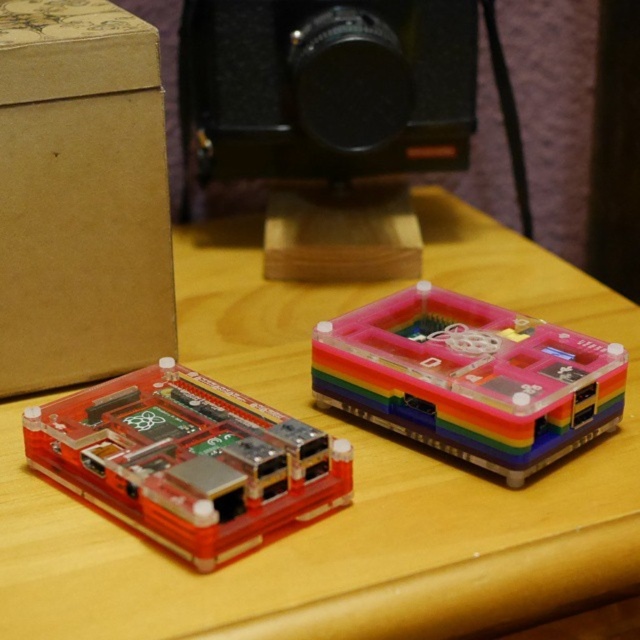
Identify the location of translucent plastic electronics at center. (355, 476).

In order to click on translucent plastic electronics at center in this screenshot , I will do `click(355, 476)`.

What do you see at coordinates (355, 476) in the screenshot?
I see `translucent plastic electronics at center` at bounding box center [355, 476].

Between point (298, 394) and point (449, 337), which one is positioned in front?

Positioned in front is point (449, 337).

Where is `translucent plastic electronics at center`? translucent plastic electronics at center is located at coordinates (355, 476).

Is black plastic camera at upper center to the left of rainbow plastic raspberry pi at center from the viewer's perspective?

Correct, you'll find black plastic camera at upper center to the left of rainbow plastic raspberry pi at center.

Is black plastic camera at upper center to the right of rainbow plastic raspberry pi at center from the viewer's perspective?

Incorrect, black plastic camera at upper center is not on the right side of rainbow plastic raspberry pi at center.

Who is more forward, (467,33) or (605,368)?

Point (605,368)

Locate an element on the screen. Image resolution: width=640 pixels, height=640 pixels. black plastic camera at upper center is located at coordinates (324, 88).